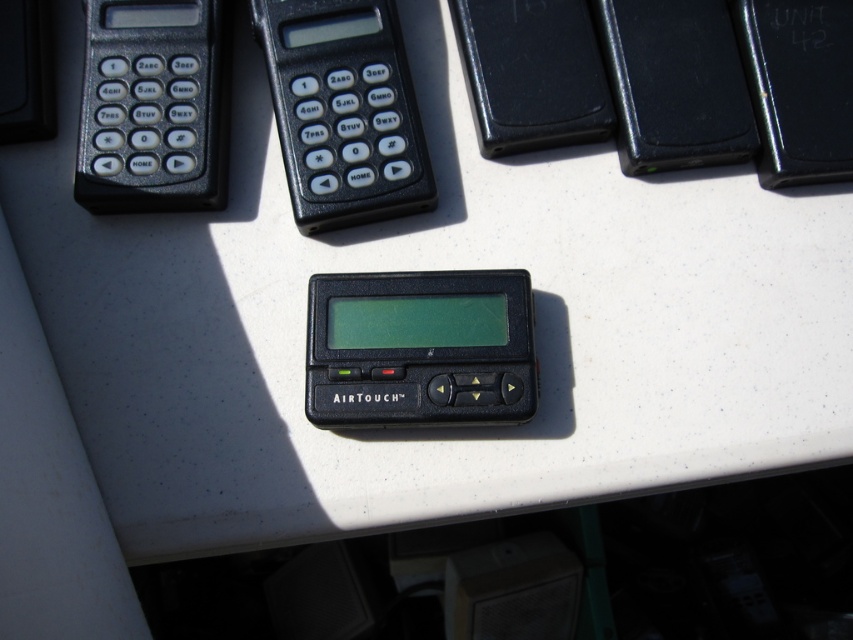
You are holding a smartphone and want to take a photo of the black plastic calculator at upper center. The calculator is 76.47 centimeters from the camera. If your smartphone has a maximum autofocus range of 1 meter, will it be able to focus on the calculator?

The black plastic calculator at upper center is 76.47 centimeters from the camera, which is within the smartphone camera maximum autofocus range of 1 meter. Therefore, the smartphone should be able to focus on the calculator.

You are organizing a desk and see the black plastic calculator at upper center and the black plastic calculator at upper left. Which one is positioned higher on the desk?

The black plastic calculator at upper center is positioned higher on the desk than the black plastic calculator at upper left.